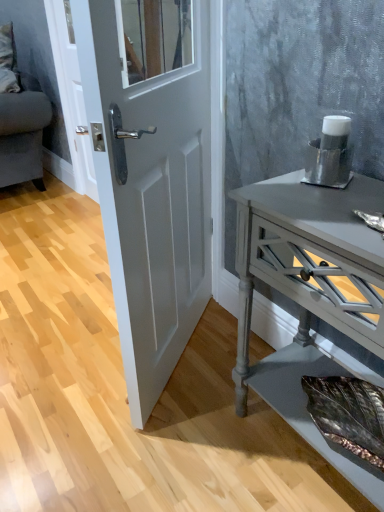
Identify the location of free space to the left of matte gray wooden nightstand at right. The height and width of the screenshot is (512, 384). (197, 448).